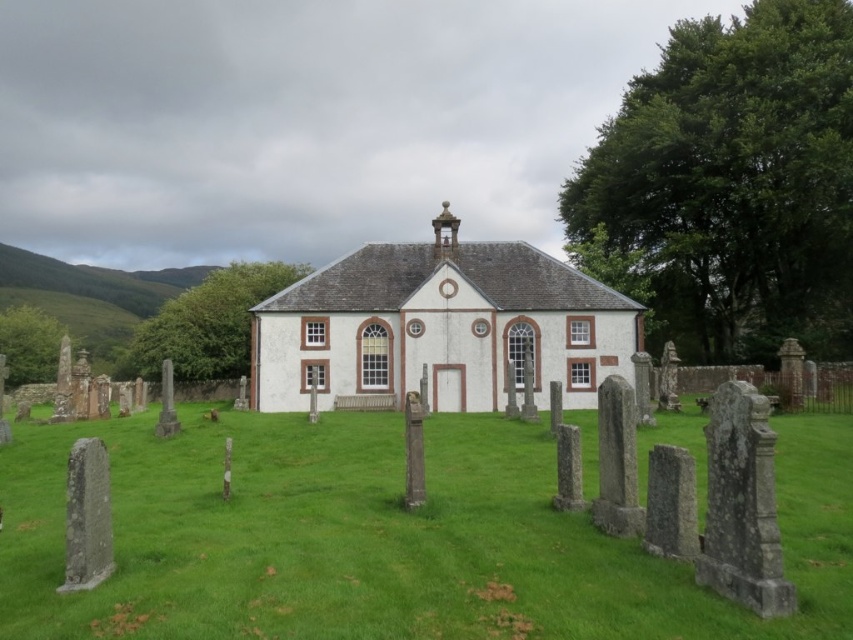
Is green grass at center taller than white painted wood church at center?

No, green grass at center is not taller than white painted wood church at center.

Between green grass at center and white painted wood church at center, which one has more height?

Standing taller between the two is white painted wood church at center.

Image resolution: width=853 pixels, height=640 pixels. In order to click on green grass at center in this screenshot , I will do `click(387, 538)`.